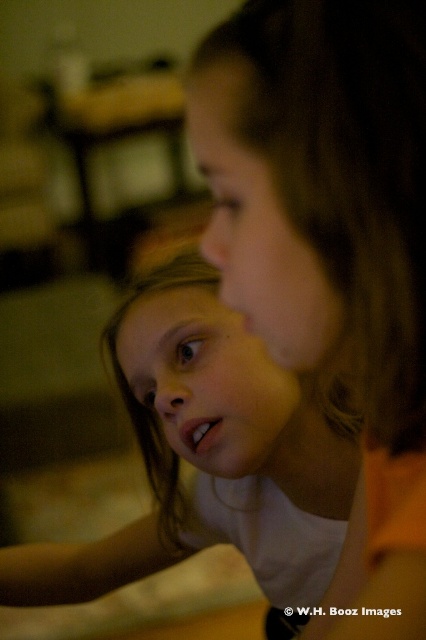
Does matte orange shirt at center come in front of smooth white shirt at center?

Yes.

Where is `matte orange shirt at center`? matte orange shirt at center is located at coordinates (331, 250).

Image resolution: width=426 pixels, height=640 pixels. Describe the element at coordinates (331, 250) in the screenshot. I see `matte orange shirt at center` at that location.

Identify the location of matte orange shirt at center. (331, 250).